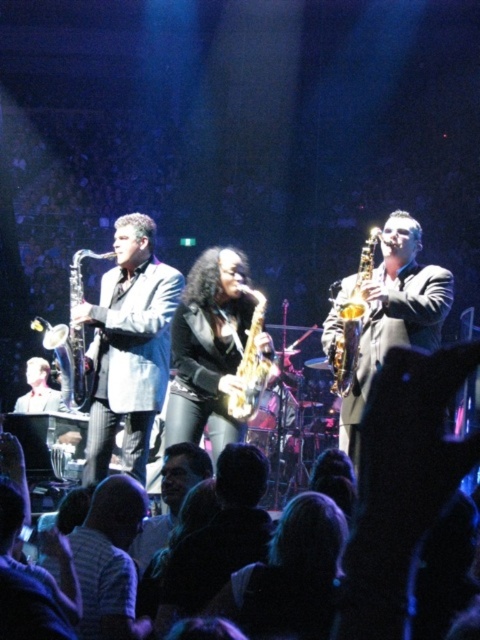
Does point (83, 248) come behind point (348, 388)?

Yes, point (83, 248) is behind point (348, 388).

Between point (63, 388) and point (349, 330), which one is positioned in front?

Point (349, 330) is in front.

Locate an element on the screen. Image resolution: width=480 pixels, height=640 pixels. shiny gold saxophone at left is located at coordinates (68, 362).

Can you confirm if matte gray suit at left is positioned to the right of gold metallic saxophone at center?

In fact, matte gray suit at left is to the left of gold metallic saxophone at center.

This screenshot has width=480, height=640. What do you see at coordinates (129, 348) in the screenshot? I see `matte gray suit at left` at bounding box center [129, 348].

Identify the location of matte gray suit at left. (129, 348).

Which is behind, point (126, 417) or point (339, 381)?

The point (126, 417) is more distant.

Is matte gray suit at left shorter than gold lacquered saxophone at center?

No.

What do you see at coordinates (129, 348) in the screenshot? The width and height of the screenshot is (480, 640). I see `matte gray suit at left` at bounding box center [129, 348].

Find the location of a particular element. The width and height of the screenshot is (480, 640). matte gray suit at left is located at coordinates point(129,348).